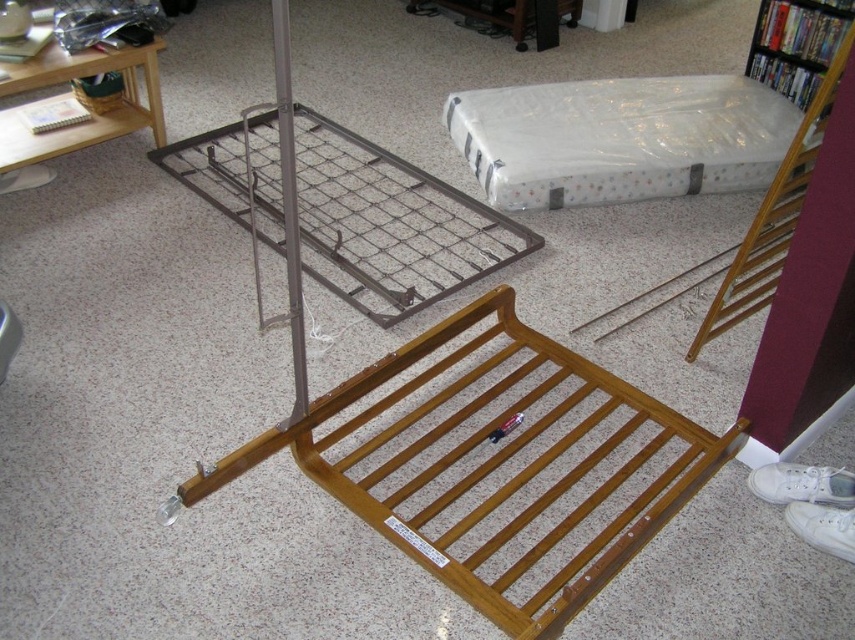
Question: Which point is farther from the camera taking this photo?

Choices:
 (A) (795, 38)
 (B) (556, 448)
 (C) (759, 125)

Answer: (A)

Question: Can you confirm if wooden slatted bed frame at center is thinner than wooden bookshelf at upper right?

Choices:
 (A) yes
 (B) no

Answer: (B)

Question: In this image, where is wooden slatted bed frame at center located relative to white plastic mattress at upper right?

Choices:
 (A) above
 (B) below

Answer: (B)

Question: Can you confirm if white plastic mattress at upper right is positioned above wooden bookshelf at upper right?

Choices:
 (A) no
 (B) yes

Answer: (A)

Question: Which point appears farthest from the camera in this image?

Choices:
 (A) (791, 64)
 (B) (470, 166)
 (C) (382, 524)

Answer: (A)

Question: Estimate the real-world distances between objects in this image. Which object is closer to the wooden bookshelf at upper right?

Choices:
 (A) wooden slatted bed frame at center
 (B) white plastic mattress at upper right

Answer: (B)